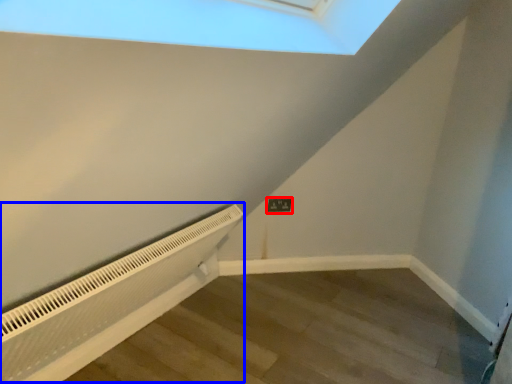
Question: Which object is further to the camera taking this photo, electric outlet (highlighted by a red box) or air conditioner (highlighted by a blue box)?

Choices:
 (A) electric outlet
 (B) air conditioner

Answer: (A)